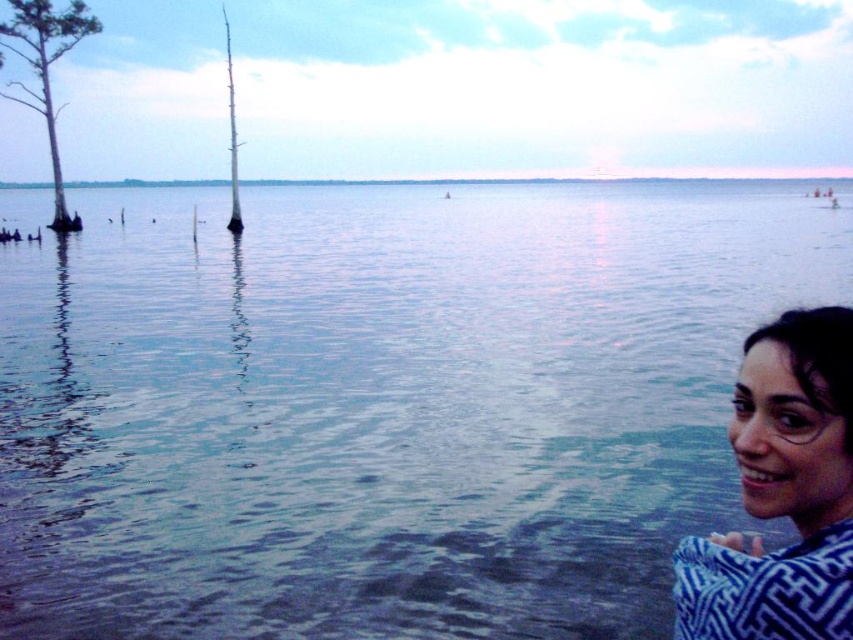
Question: Which of the following is the farthest from the observer?

Choices:
 (A) clear water at center
 (B) green matte tree at left
 (C) brown wood tree at left
 (D) blue woven fabric at lower right

Answer: (B)

Question: Does clear water at center appear on the left side of brown wood tree at left?

Choices:
 (A) no
 (B) yes

Answer: (A)

Question: Which of the following is the closest to the observer?

Choices:
 (A) blue woven fabric at lower right
 (B) clear water at center
 (C) brown wood tree at left
 (D) green matte tree at left

Answer: (A)

Question: Does clear water at center have a lesser width compared to green matte tree at left?

Choices:
 (A) no
 (B) yes

Answer: (A)

Question: Does clear water at center have a greater width compared to brown wood tree at left?

Choices:
 (A) no
 (B) yes

Answer: (B)

Question: Which of the following is the closest to the observer?

Choices:
 (A) (16, 17)
 (B) (235, 200)
 (C) (190, 387)
 (D) (723, 570)

Answer: (D)